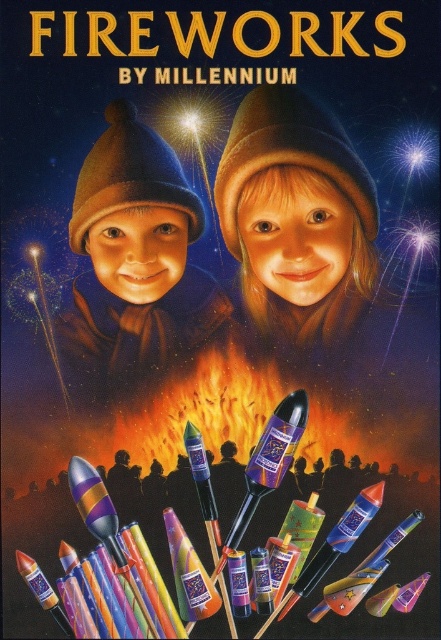
Between smooth brown hat at center and matte brown hat at center, which one has more height?

matte brown hat at center

In the scene shown: Which is more to the right, smooth brown hat at center or matte brown hat at center?

smooth brown hat at center is more to the right.

Between point (266, 243) and point (167, 227), which one is positioned behind?

The point (266, 243) is more distant.

The image size is (441, 640). In order to click on smooth brown hat at center in this screenshot , I will do `click(298, 218)`.